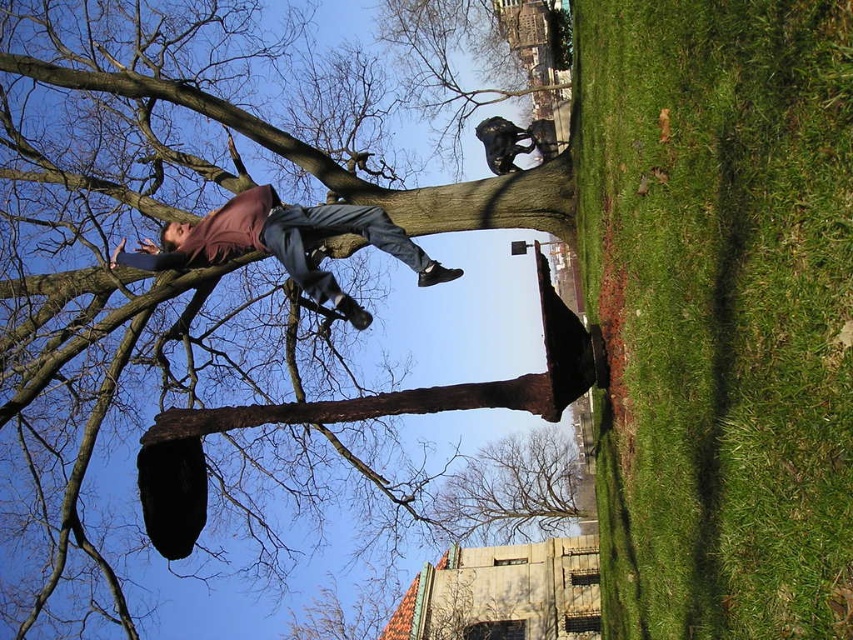
Which is more to the right, brown rough tree trunk at upper center or matte brown pants at upper center?

brown rough tree trunk at upper center

The width and height of the screenshot is (853, 640). Describe the element at coordinates (207, 291) in the screenshot. I see `brown rough tree trunk at upper center` at that location.

You are a GUI agent. You are given a task and a screenshot of the screen. Output one action in this format:
    pyautogui.click(x=<x>, y=<y>)
    Task: Click on the brown rough tree trunk at upper center
    
    Given the screenshot: What is the action you would take?
    pyautogui.click(x=207, y=291)